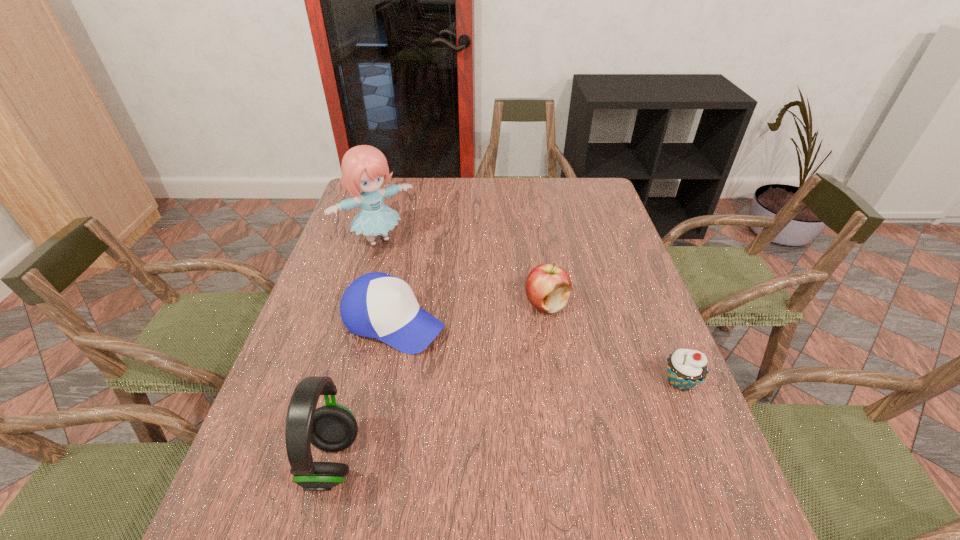
This screenshot has width=960, height=540. Identify the location of vacant space situated on the front-facing side of the tallest object. (412, 272).

Locate an element on the screen. vacant space located 0.220m on the front-facing side of the tallest object is located at coordinates (431, 293).

Locate an element on the screen. The image size is (960, 540). free space located 0.130m on the front-facing side of the tallest object is located at coordinates (416, 276).

Where is `vacant space situated on the front-facing side of the baseball cap`? Image resolution: width=960 pixels, height=540 pixels. vacant space situated on the front-facing side of the baseball cap is located at coordinates (473, 357).

What are the coordinates of `blank area located 0.260m on the front-facing side of the baseball cap` in the screenshot? It's located at click(529, 386).

This screenshot has height=540, width=960. In order to click on free space located 0.080m on the front-facing side of the baseball cap in this screenshot , I will do `click(463, 352)`.

This screenshot has width=960, height=540. Identify the location of vacant space positioned on the bitten side of the apple. (538, 349).

Identify the location of free space located on the bitten side of the apple. The height and width of the screenshot is (540, 960). (526, 408).

Identify the location of free space located on the bitten side of the apple. This screenshot has width=960, height=540. (516, 461).

This screenshot has width=960, height=540. I want to click on object located in the near edge section of the desktop, so click(x=331, y=428).